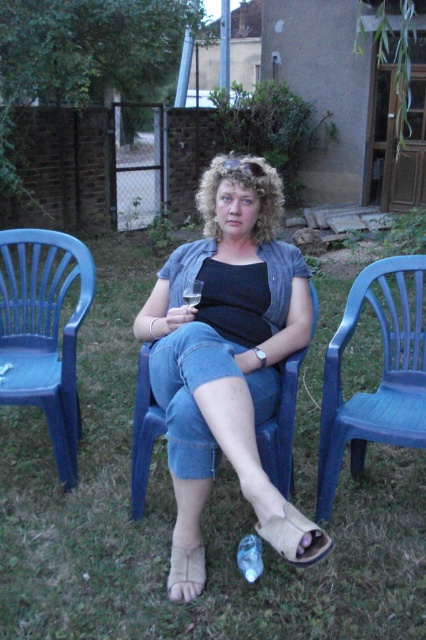
You are standing at the point labeled point (273, 582) and want to walk to the point labeled point (187, 476). Which direction should you move to get closer to your destination?

To move from point (273, 582) to point (187, 476), you should move forward because point (273, 582) is behind point (187, 476).

You are planning to place a small potted plant between the green grass at center and the blue plastic chair at right. Based on their positions, where should the potted plant be placed?

The green grass at center is in front of the blue plastic chair at right, so the potted plant should be placed between them, closer to the green grass at center to maintain the spatial relationship.